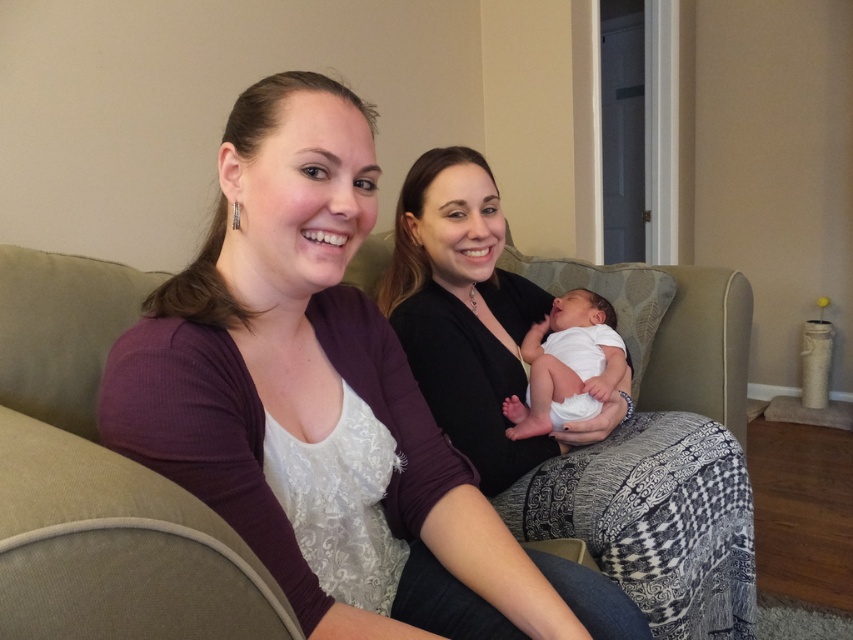
Question: Is purple ribbed cardigan at left wider than matte black shirt at center?

Choices:
 (A) yes
 (B) no

Answer: (B)

Question: Which of the following is the farthest from the observer?

Choices:
 (A) (157, 316)
 (B) (619, 358)
 (C) (415, 243)

Answer: (B)

Question: Does purple ribbed cardigan at left appear on the right side of matte black shirt at center?

Choices:
 (A) no
 (B) yes

Answer: (A)

Question: Among these points, which one is farthest from the camera?

Choices:
 (A) (561, 445)
 (B) (598, 358)

Answer: (B)

Question: Does matte black shirt at center have a larger size compared to white clothed newborn at center?

Choices:
 (A) no
 (B) yes

Answer: (B)

Question: Which object is farther from the camera taking this photo?

Choices:
 (A) matte black shirt at center
 (B) purple ribbed cardigan at left

Answer: (A)